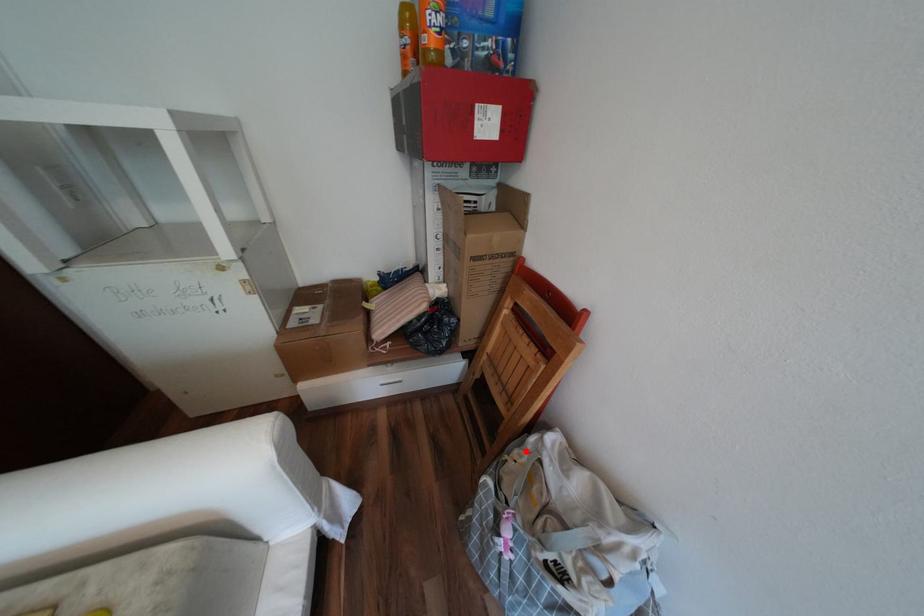
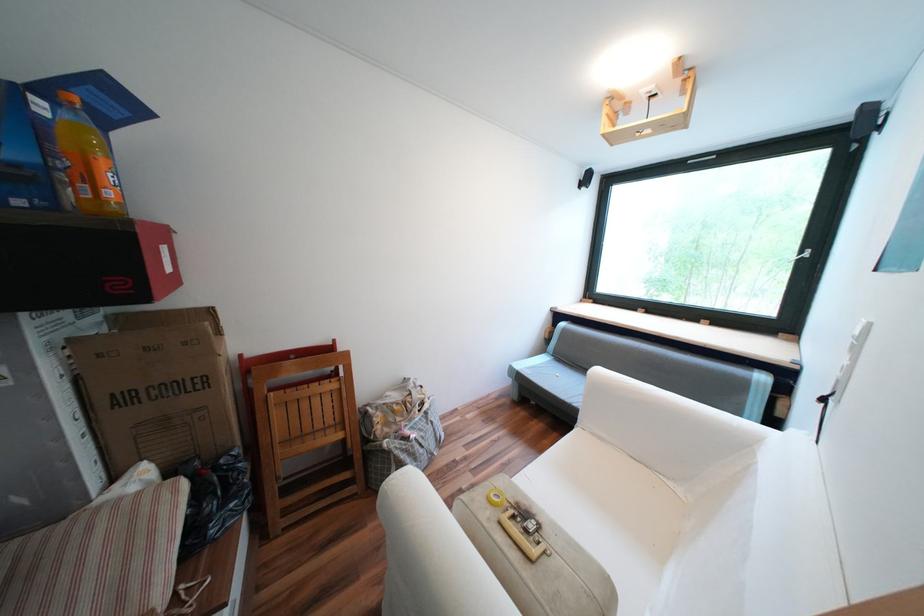
Question: I am providing you with two images of the same scene from different viewpoints. Given a red point in image1, look at the same physical point in image2. Is it:

Choices:
 (A) Closer to the viewpoint
 (B) Farther from the viewpoint

Answer: (B)